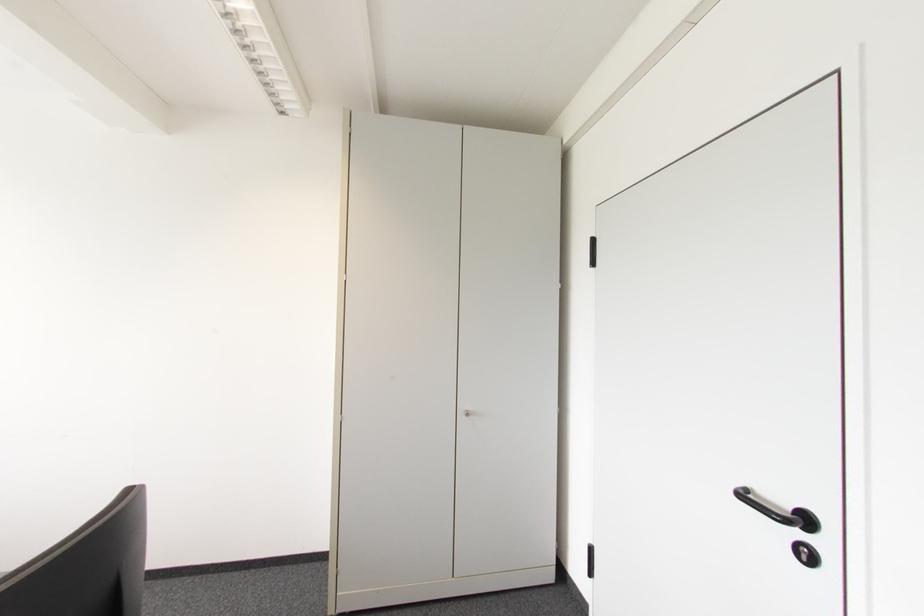
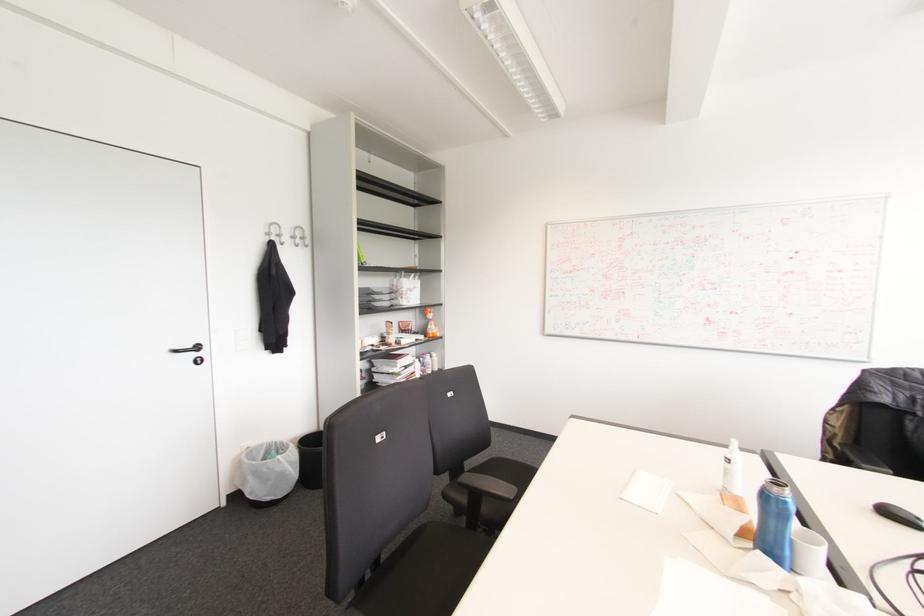
In the second image, find the point that corresponds to (x=805, y=521) in the first image.

(197, 347)